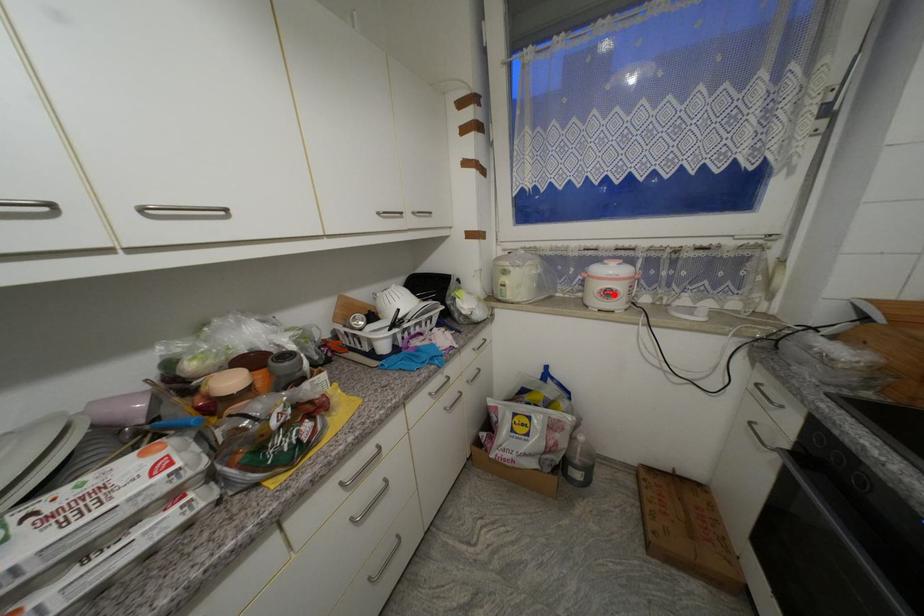
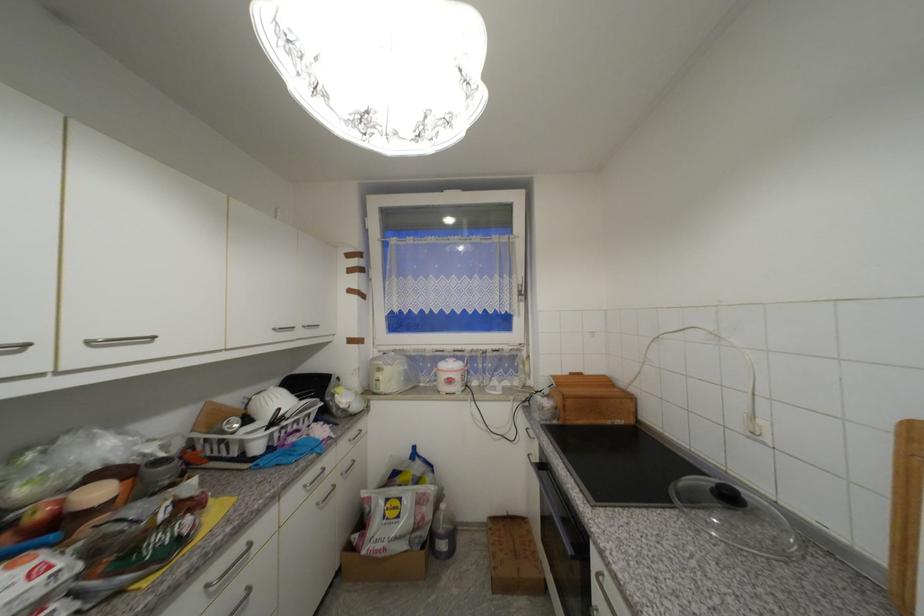
Question: I am providing you with two images of the same scene from different viewpoints. A red point is shown in image1. For the corresponding object point in image2, is it positioned nearer or farther from the camera?

Choices:
 (A) Nearer
 (B) Farther

Answer: (B)